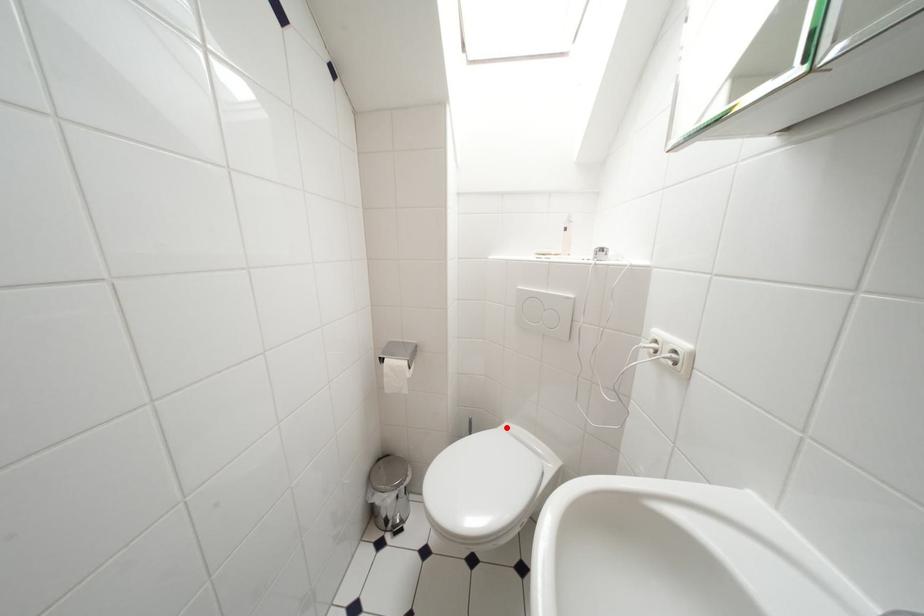
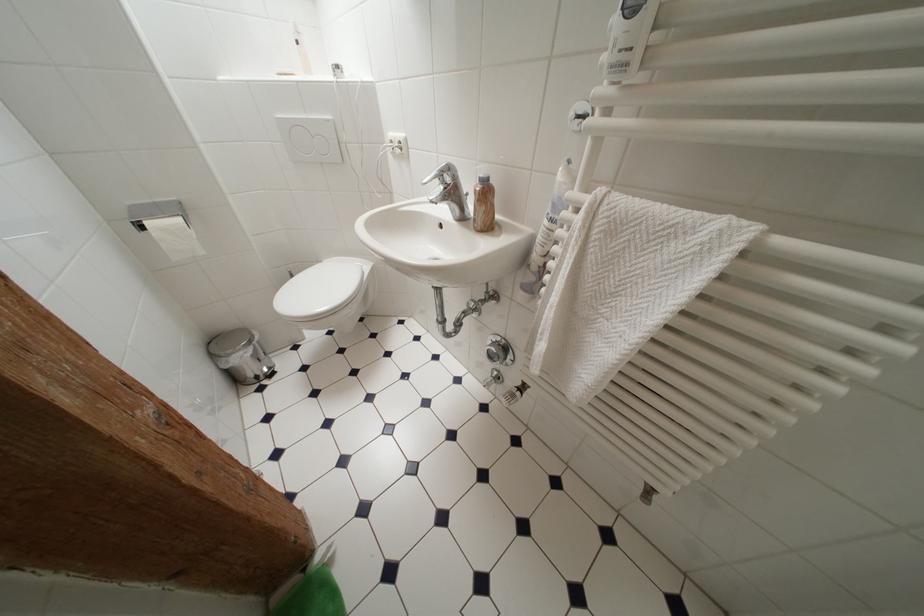
Find the pixel in the second image that matches the highlighted location in the first image.

(325, 265)